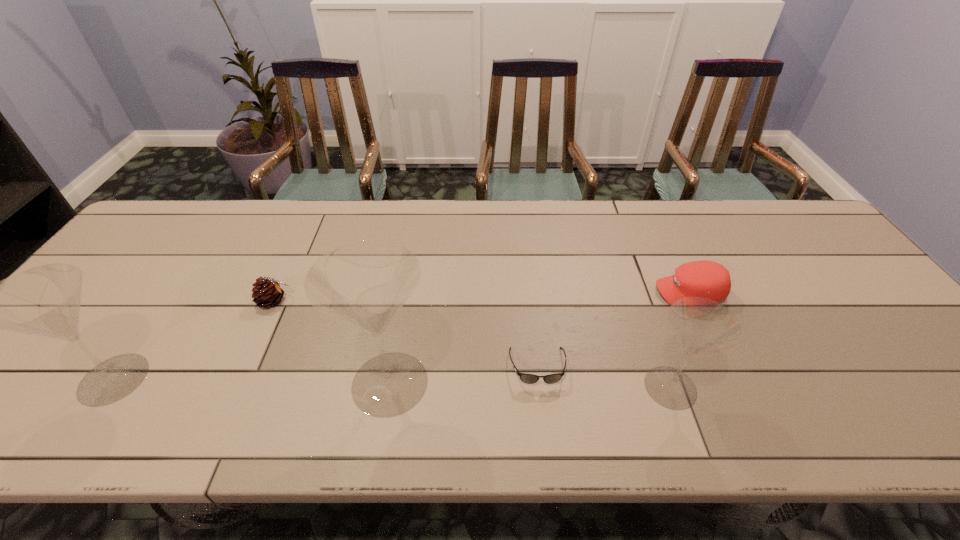
You are a GUI agent. You are given a task and a screenshot of the screen. Output one action in this format:
    pyautogui.click(x=<x>, y=<y>)
    Task: Click on the vacant region located 0.120m on the left of the second shortest flute glass
    The image size is (960, 540).
    Given the screenshot: What is the action you would take?
    [x=23, y=379]

At what (x,y) coordinates should I click in order to perform the action: click on blank area located 0.200m on the back of the second flute glass from left to right. Please return your answer as a coordinate pair (x, y). Image resolution: width=960 pixels, height=540 pixels. Looking at the image, I should click on (406, 287).

The width and height of the screenshot is (960, 540). Identify the location of vacant position located 0.370m on the back of the fourth shortest object. point(624,256).

Image resolution: width=960 pixels, height=540 pixels. I want to click on vacant area situated 0.310m on the front-facing side of the cap, so [539, 292].

This screenshot has width=960, height=540. I want to click on vacant space situated 0.160m on the front-facing side of the cap, so click(595, 292).

Find the location of `free space located 0.220m on the front-facing side of the cap`. free space located 0.220m on the front-facing side of the cap is located at coordinates (572, 292).

Locate an element on the screen. The image size is (960, 540). free space located with a leaf charm attached to the pinecone is located at coordinates (357, 301).

At what (x,y) coordinates should I click in order to perform the action: click on sunglasses positioned at the near edge. Please return your answer as a coordinate pair (x, y). Image resolution: width=960 pixels, height=540 pixels. Looking at the image, I should click on (524, 377).

Locate an element on the screen. object that is at the left edge is located at coordinates (45, 300).

Identify the location of object that is at the near left corner. Image resolution: width=960 pixels, height=540 pixels. (45, 300).